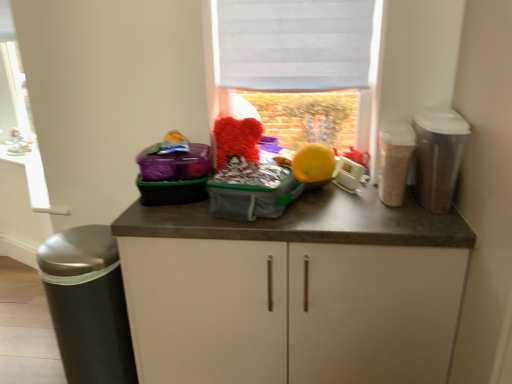
The image size is (512, 384). I want to click on free spot in front of translucent plastic canister at right, the first appliance when ordered from right to left, so click(x=431, y=230).